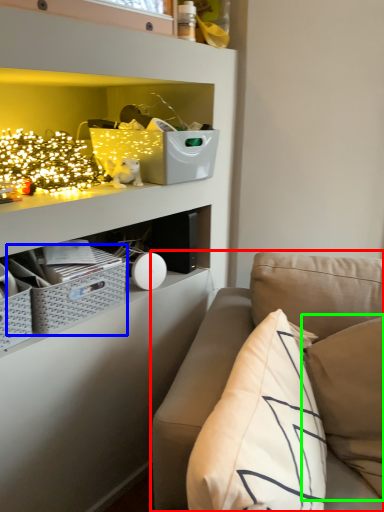
Question: Which is nearer to the studio couch (highlighted by a red box)? crate (highlighted by a blue box) or pillow (highlighted by a green box).

Choices:
 (A) crate
 (B) pillow

Answer: (B)